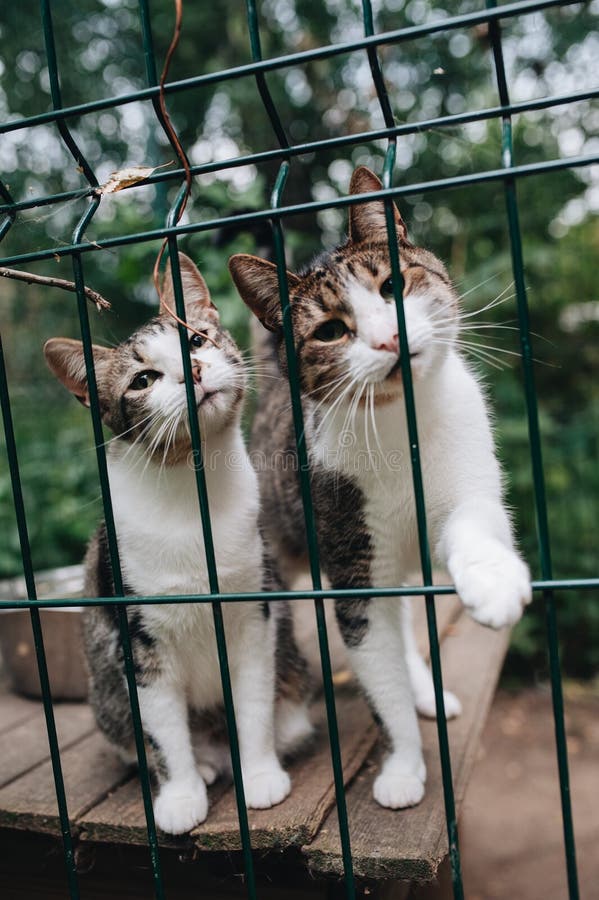
Identify the location of dish. (49, 641).